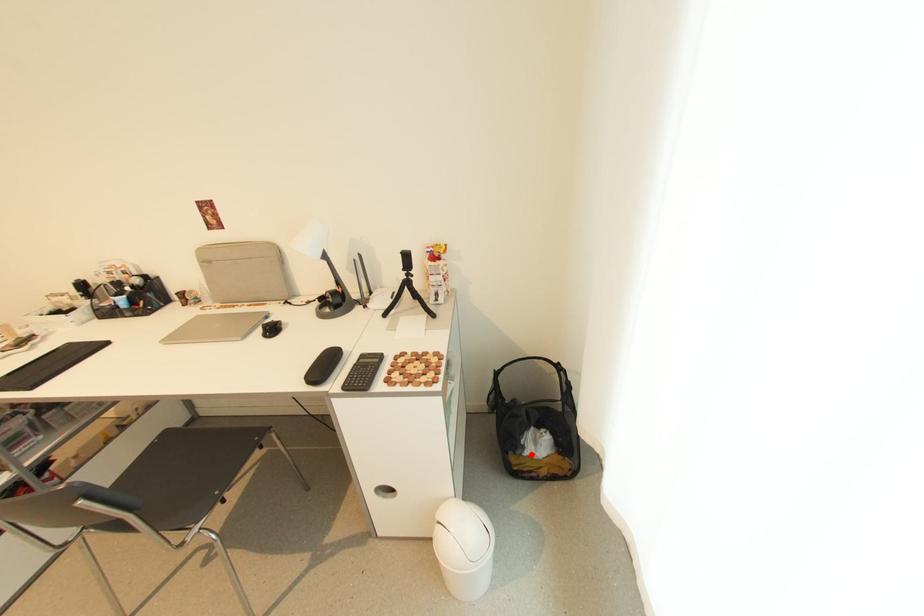
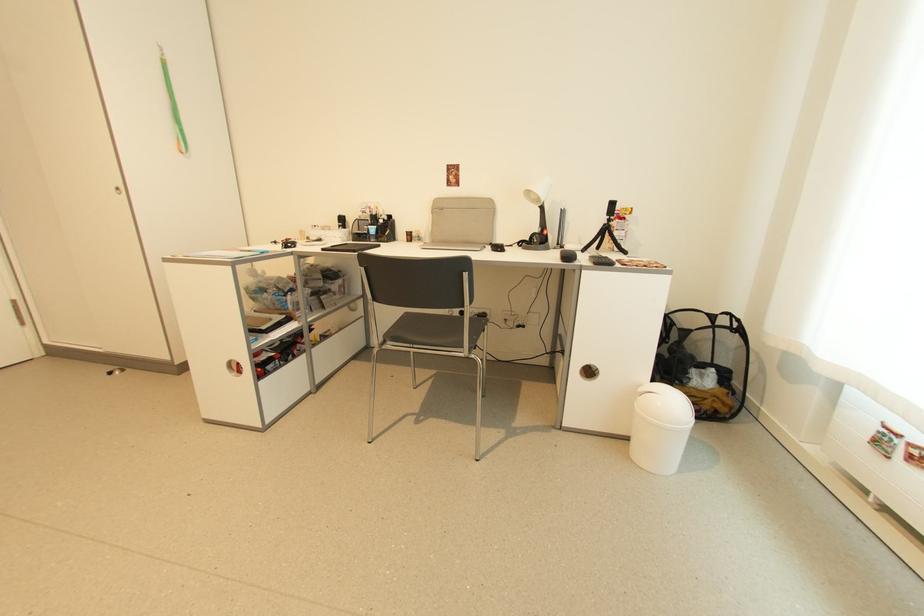
Question: I am providing you with two images of the same scene from different viewpoints. Image1 has a red point marked. In image2, the corresponding 3D location appears at what relative position? Reply with the corresponding letter.

Choices:
 (A) Closer
 (B) Farther

Answer: (A)